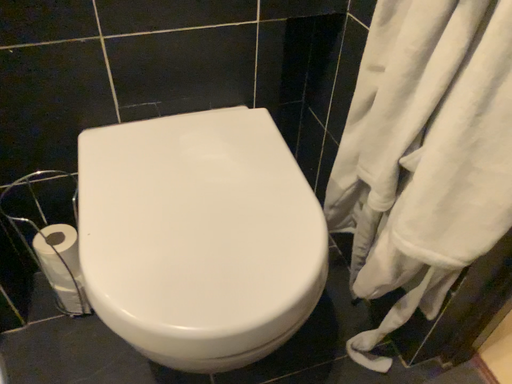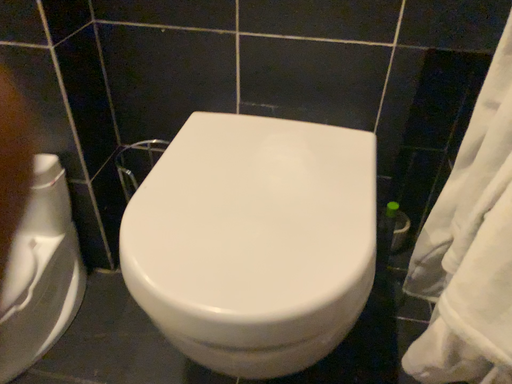
Question: Which way did the camera rotate in the video?

Choices:
 (A) rotated upward
 (B) rotated downward

Answer: (A)